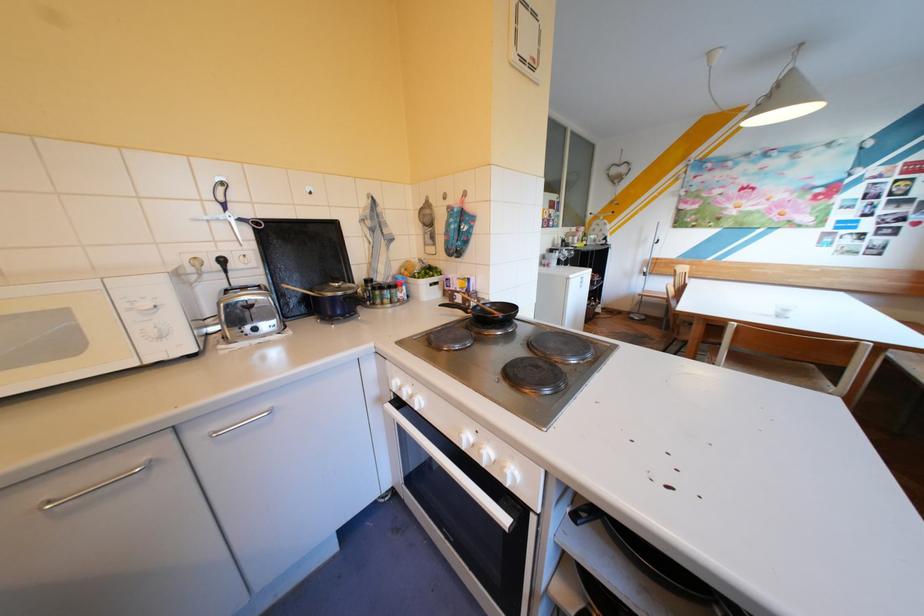
What do you see at coordinates (455, 307) in the screenshot? This screenshot has height=616, width=924. I see `the frying pan handle` at bounding box center [455, 307].